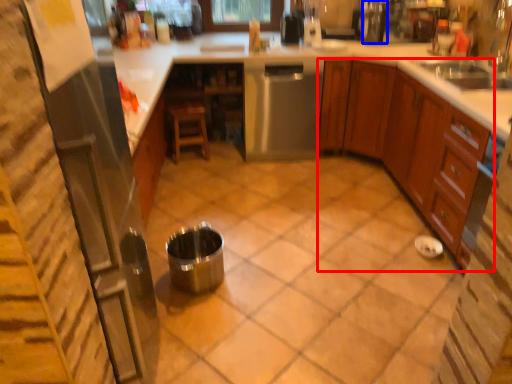
Question: Among these objects, which one is farthest to the camera, cabinetry (highlighted by a red box) or appliance (highlighted by a blue box)?

Choices:
 (A) cabinetry
 (B) appliance

Answer: (B)